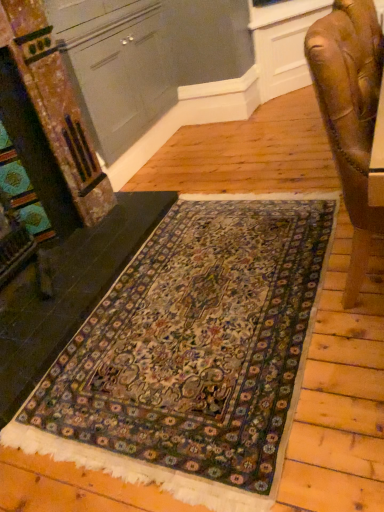
Question: Is point (339, 5) positioned closer to the camera than point (256, 271)?

Choices:
 (A) closer
 (B) farther

Answer: (A)

Question: In the image, is wooden carved chair at right positioned in front of or behind carpeted rug at center?

Choices:
 (A) front
 (B) behind

Answer: (A)

Question: Which is farther from the wooden carved chair at right?

Choices:
 (A) matte gray cabinet at upper left
 (B) carpeted rug at center
 (C) carpet at lower left

Answer: (A)

Question: Which of these objects is positioned farthest from the carpet at lower left?

Choices:
 (A) wooden carved chair at right
 (B) matte gray cabinet at upper left
 (C) carpeted rug at center

Answer: (A)